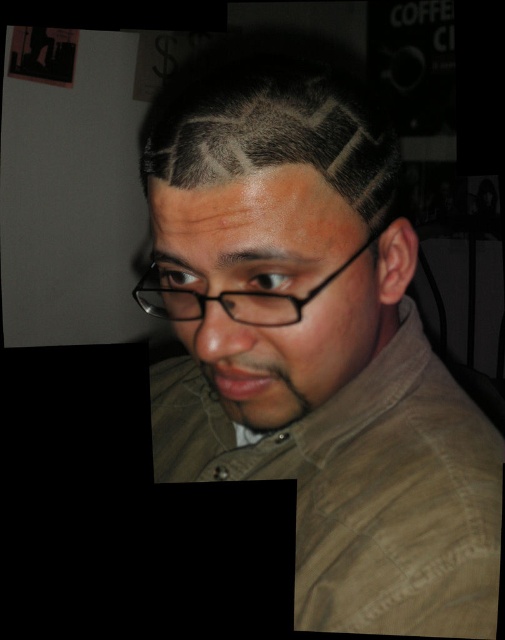
You are a stylist observing a client with dark gray hair at center and black plastic glasses at center. Which object is positioned higher on their head?

The dark gray hair at center is taller than black plastic glasses at center, so the dark gray hair at center is positioned higher on their head.

You are a stylist analyzing a client photo. The client has dark gray hair at center and black plastic glasses at center. Which object takes up more space in the photo?

The dark gray hair at center has a larger size compared to the black plastic glasses at center, so the dark gray hair at center takes up more space in the photo.

Looking at the person in the image, which hair color is positioned to the left between the dark brown hair at center and the dark gray hair at center?

The dark brown hair at center is positioned to the left of the dark gray hair at center.